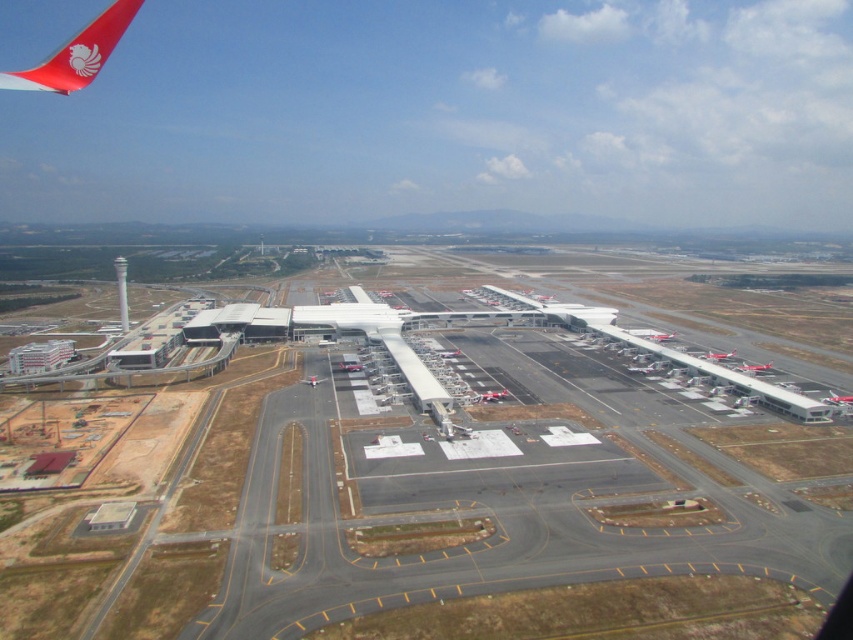
You are a drone operator trying to navigate between two points in the airport image. The first point is at coordinates point (643, 330) and the second is at point (828, 396). Which point is closer to the camera based on their positions?

Point (828, 396) is closer to the camera because point (643, 330) is behind it.

Consider the image. You are a drone operator trying to navigate a drone from point A to point B in the airport. The coordinates for point A are point (117, 33) and point B are point (834, 394). According to the image, which point is closer to the camera? Please answer based on their positions in the scene.

Point (117, 33) is in front of point (834, 394), so it is closer to the camera.

You are a ground crew member at the airport. You need to park a new metallic silver airplane that is 50 meters wide. There is space available where the metallic silver airplane at right and metallic silver airplane at center are currently parked. Which of the two existing airplanes should you move to accommodate the new one?

The metallic silver airplane at right is wider than the metallic silver airplane at center. Since the new airplane is 50 meters wide, you should move the metallic silver airplane at right to make space because it occupies a larger area.